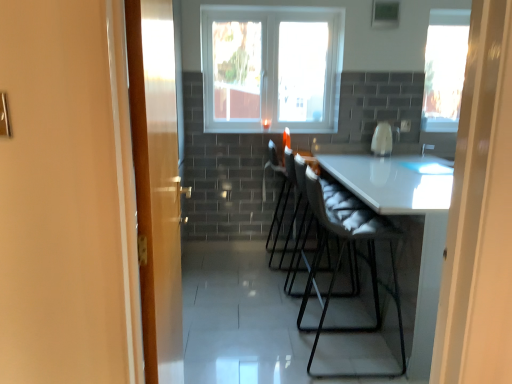
Question: From a real-world perspective, does transparent glass window at center, marked as the first window in a left-to-right arrangement, stand above white fabric folding chair at center?

Choices:
 (A) yes
 (B) no

Answer: (A)

Question: Considering the relative sizes of transparent glass window at center, the second window in the right-to-left sequence, and white fabric folding chair at center in the image provided, is transparent glass window at center, the second window in the right-to-left sequence, wider than white fabric folding chair at center?

Choices:
 (A) yes
 (B) no

Answer: (B)

Question: Does transparent glass window at center, the second window in the right-to-left sequence, appear on the right side of white fabric folding chair at center?

Choices:
 (A) no
 (B) yes

Answer: (A)

Question: Can you see transparent glass window at center, marked as the first window in a left-to-right arrangement, touching white fabric folding chair at center?

Choices:
 (A) yes
 (B) no

Answer: (B)

Question: Is transparent glass window at center, the second window in the right-to-left sequence, closer to the viewer compared to white fabric folding chair at center?

Choices:
 (A) no
 (B) yes

Answer: (A)

Question: Does point (437, 74) appear closer or farther from the camera than point (216, 18)?

Choices:
 (A) farther
 (B) closer

Answer: (A)

Question: From the image's perspective, relative to transparent glass window at center, marked as the first window in a left-to-right arrangement, is transparent glass window at upper right, the first window from the right, above or below?

Choices:
 (A) below
 (B) above

Answer: (A)

Question: Is transparent glass window at upper right, the second window when ordered from left to right, taller or shorter than transparent glass window at center, marked as the first window in a left-to-right arrangement?

Choices:
 (A) tall
 (B) short

Answer: (B)

Question: Visually, is transparent glass window at upper right, the second window when ordered from left to right, positioned to the left or to the right of transparent glass window at center, the second window in the right-to-left sequence?

Choices:
 (A) right
 (B) left

Answer: (A)

Question: Is wooden door at left wider or thinner than white fabric folding chair at center?

Choices:
 (A) thin
 (B) wide

Answer: (A)

Question: From a real-world perspective, is wooden door at left positioned above or below white fabric folding chair at center?

Choices:
 (A) above
 (B) below

Answer: (A)

Question: Is wooden door at left in front of or behind white fabric folding chair at center in the image?

Choices:
 (A) front
 (B) behind

Answer: (A)

Question: In terms of height, does wooden door at left look taller or shorter compared to white fabric folding chair at center?

Choices:
 (A) short
 (B) tall

Answer: (B)

Question: Does point (436, 23) appear closer or farther from the camera than point (373, 139)?

Choices:
 (A) farther
 (B) closer

Answer: (A)

Question: Is transparent glass window at upper right, the second window when ordered from left to right, in front of or behind white glossy coffee machine at center in the image?

Choices:
 (A) front
 (B) behind

Answer: (B)